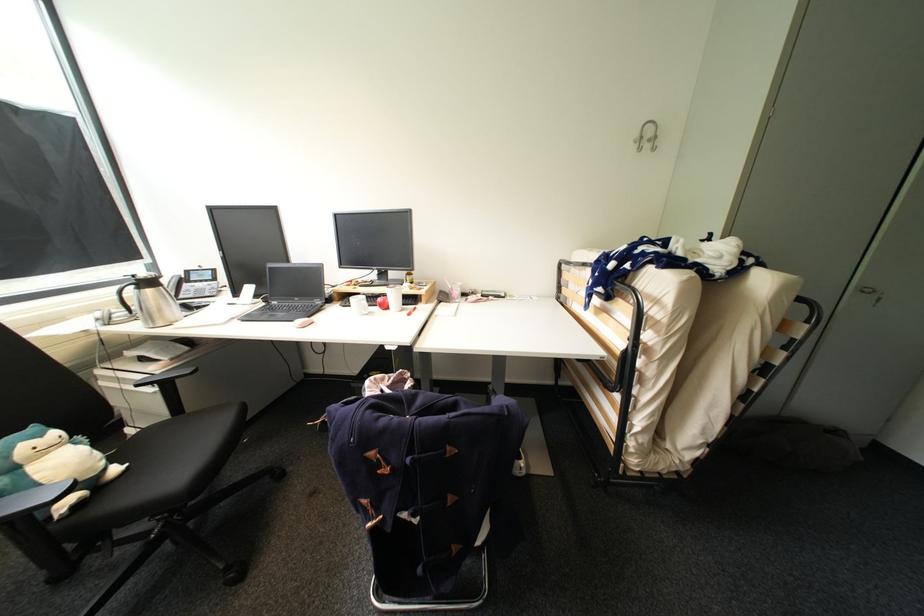
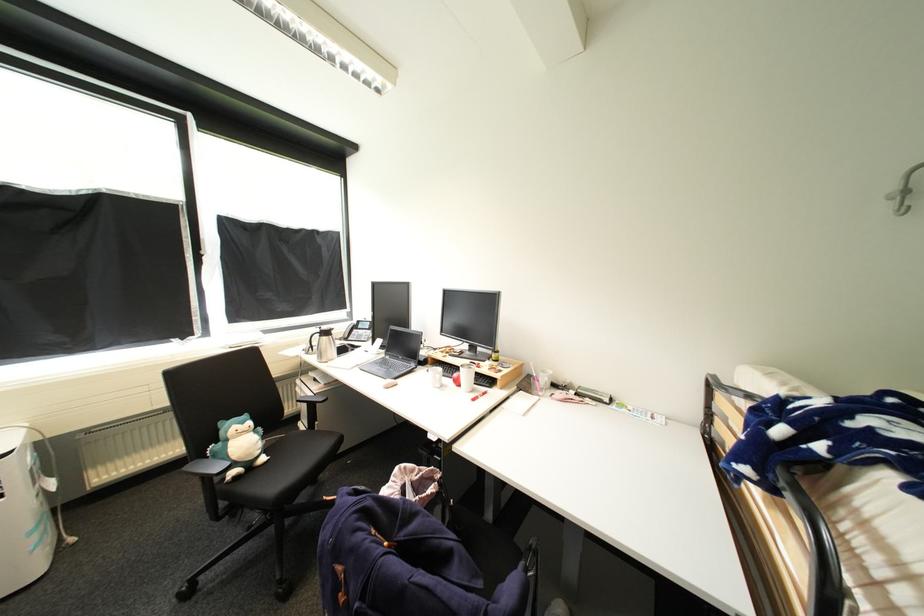
Question: I am providing you with two images of the same scene from different viewpoints. Which of the following objects are not visible in image2?

Choices:
 (A) black chair armrest
 (B) metal wall hook
 (C) telephone handset
 (D) none of these

Answer: (D)